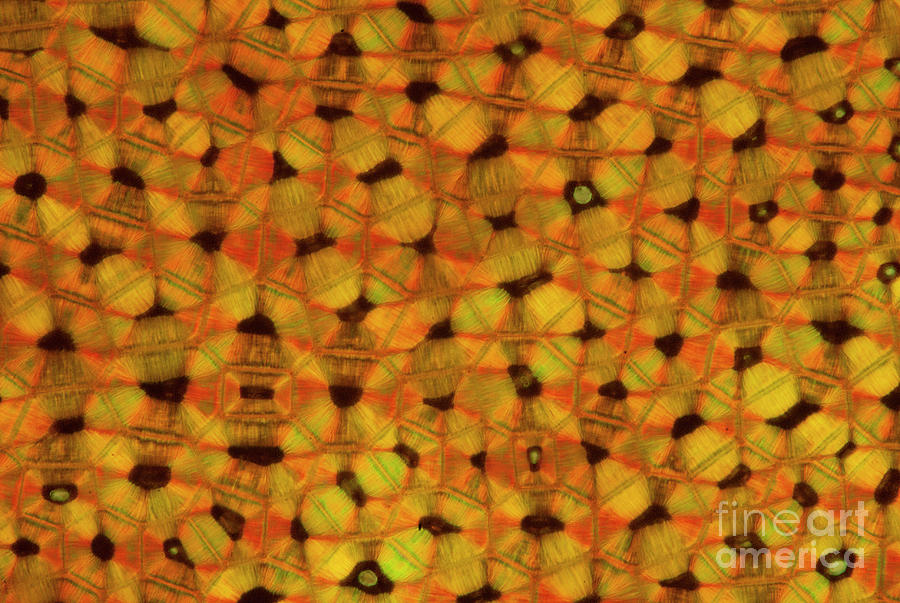
Locate an element on the screen. The width and height of the screenshot is (900, 603). knitting corners is located at coordinates (4, 8), (7, 596), (894, 598), (896, 8).